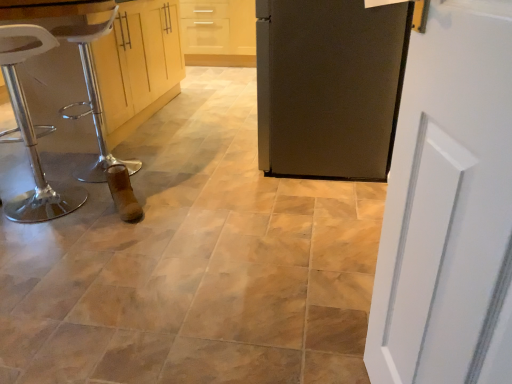
Question: Is white plastic stool at left bigger or smaller than matte black refrigerator at center, the second door viewed from the left?

Choices:
 (A) small
 (B) big

Answer: (A)

Question: From a real-world perspective, relative to matte black refrigerator at center, the second door viewed from the left, is white plastic stool at left vertically above or below?

Choices:
 (A) below
 (B) above

Answer: (A)

Question: Estimate the real-world distances between objects in this image. Which object is closer to the white plastic stool at left?

Choices:
 (A) matte black refrigerator at center, the 1th door positioned from the back
 (B) white painted wood door at right, which is the 2th door in right-to-left order
 (C) matte wood cabinetry at left
 (D) white plastic bar stool at left

Answer: (D)

Question: Based on their relative distances, which object is farther from the white plastic bar stool at left?

Choices:
 (A) white painted wood door at right, which is the first door from bottom to top
 (B) white plastic stool at left
 (C) matte black refrigerator at center, the 1th door from the top
 (D) matte wood cabinetry at left

Answer: (A)